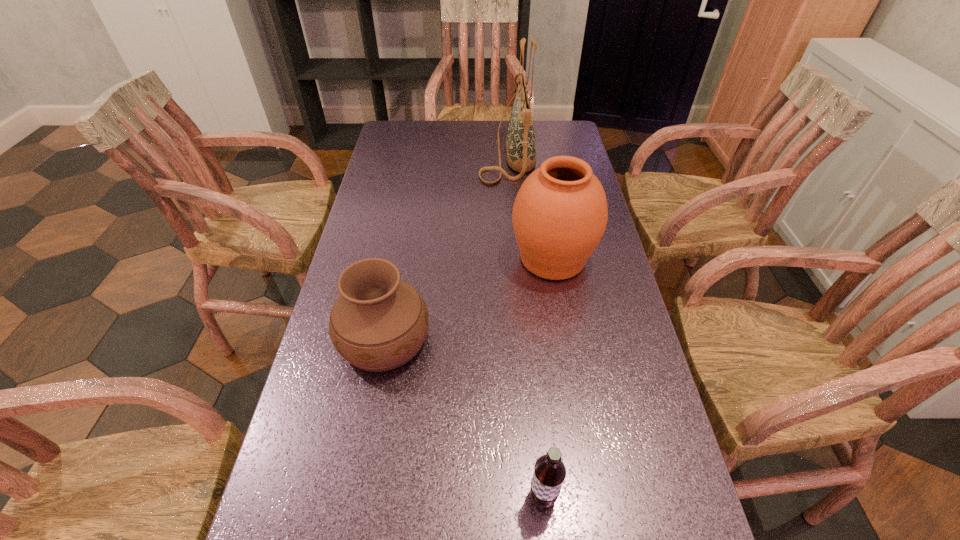
Where is `vacant space situated on the front of the right urn`? The image size is (960, 540). vacant space situated on the front of the right urn is located at coordinates (581, 432).

This screenshot has height=540, width=960. What are the coordinates of `vacant space located 0.280m on the right of the third farthest object` in the screenshot? It's located at (551, 339).

Locate an element on the screen. The height and width of the screenshot is (540, 960). vacant space located 0.380m on the left of the nearest object is located at coordinates (317, 497).

I want to click on object located at the far edge, so [520, 143].

The image size is (960, 540). What are the coordinates of `object that is at the left edge` in the screenshot? It's located at (379, 322).

Where is `object positioned at the right edge`? This screenshot has width=960, height=540. object positioned at the right edge is located at coordinates (560, 213).

The width and height of the screenshot is (960, 540). In the image, there is a desktop. In order to click on vacant space at the far edge in this screenshot , I will do [x=474, y=120].

The width and height of the screenshot is (960, 540). I want to click on free space at the left edge, so click(x=370, y=397).

This screenshot has height=540, width=960. In order to click on vacant point at the right edge in this screenshot , I will do `click(612, 269)`.

In the image, there is a desktop. Where is `blank space at the far left corner`? The height and width of the screenshot is (540, 960). blank space at the far left corner is located at coordinates (407, 145).